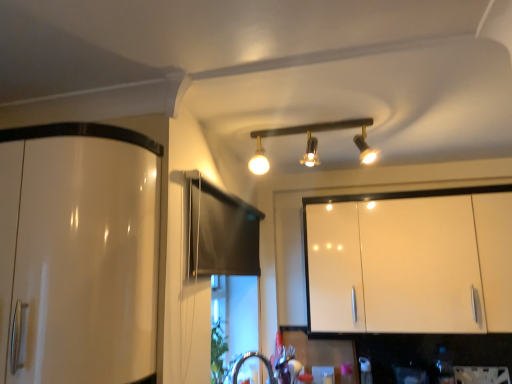
Question: Is matte black track lights at center wider or thinner than white glossy cabinet at upper right, the 2th cabinetry positioned from the left?

Choices:
 (A) thin
 (B) wide

Answer: (B)

Question: Considering the positions of matte black track lights at center and white glossy cabinet at upper right, which is the first cabinetry in back-to-front order, in the image, is matte black track lights at center taller or shorter than white glossy cabinet at upper right, which is the first cabinetry in back-to-front order,?

Choices:
 (A) short
 (B) tall

Answer: (A)

Question: Estimate the real-world distances between objects in this image. Which object is closer to the white glossy cabinet at upper right, which is the first cabinetry in back-to-front order?

Choices:
 (A) glossy white cabinet at left, the second cabinetry positioned from the back
 (B) matte black track lights at center

Answer: (B)

Question: Which is nearer to the matte black track lights at center?

Choices:
 (A) white glossy cabinet at upper right, acting as the 1th cabinetry starting from the right
 (B) glossy white cabinet at left, placed as the second cabinetry when sorted from right to left

Answer: (A)